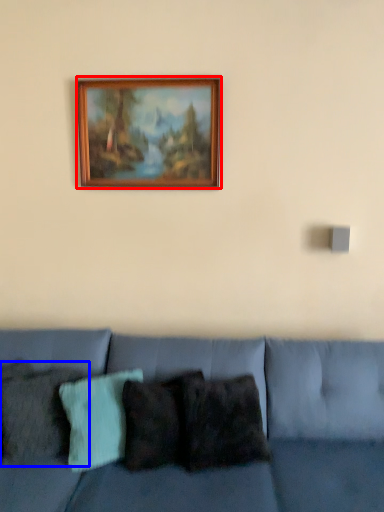
Question: Which of the following is the closest to the observer, picture frame (highlighted by a red box) or pillow (highlighted by a blue box)?

Choices:
 (A) picture frame
 (B) pillow

Answer: (B)